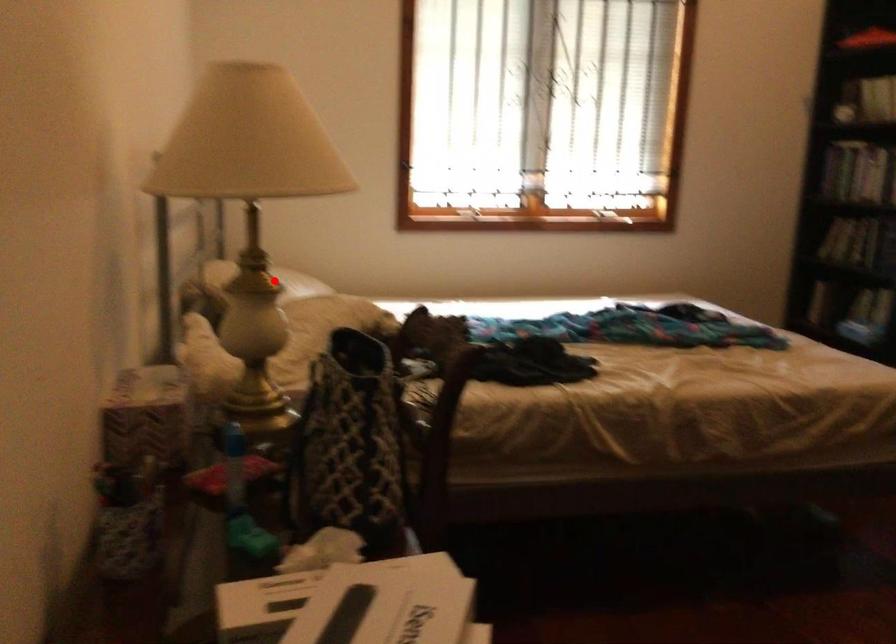
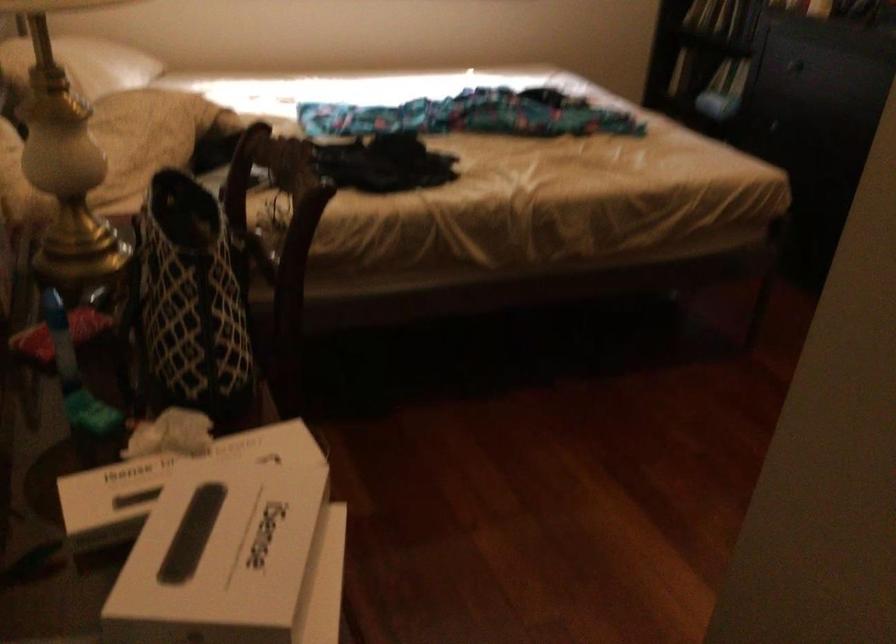
Question: A red point is marked in image1. In image2, is the corresponding 3D point closer to the camera or farther? Reply with the corresponding letter.

Choices:
 (A) The corresponding 3D point is closer.
 (B) The corresponding 3D point is farther.

Answer: (A)